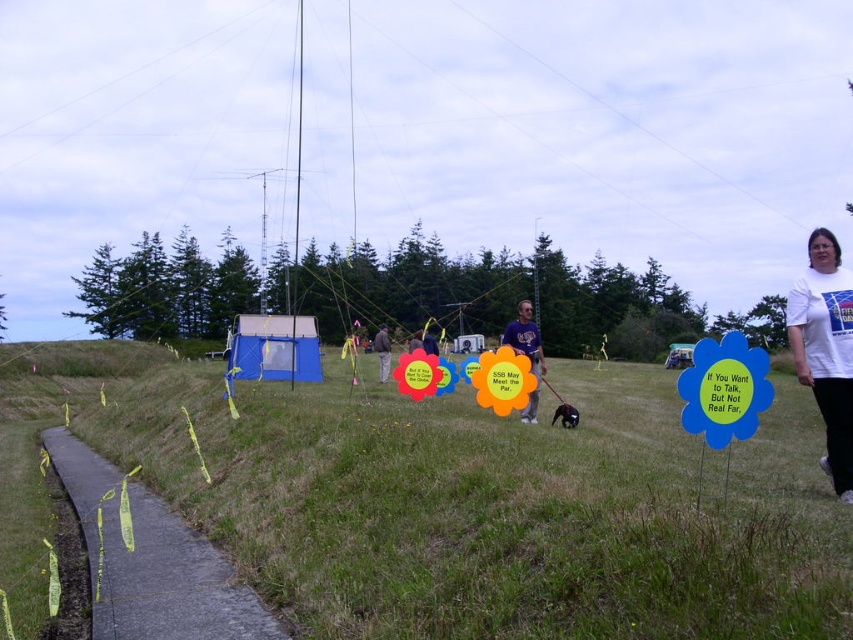
You are a photographer positioned at the edge of the grassy area. You want to capture a photo that includes both the matte purple shirt at center and the dark blue shirt at center. Based on their positions, which shirt will appear higher in the photo?

The matte purple shirt at center will appear higher in the photo because it is located above the dark blue shirt at center.